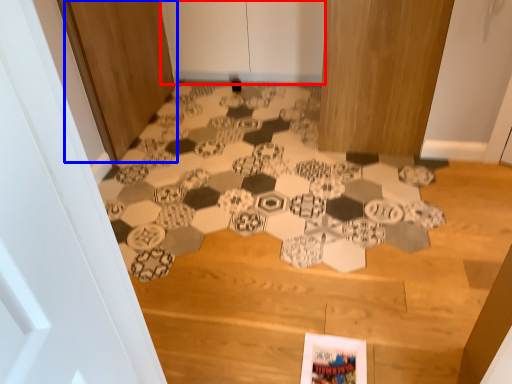
Question: Which of the following is the closest to the observer, door (highlighted by a red box) or door (highlighted by a blue box)?

Choices:
 (A) door
 (B) door

Answer: (B)